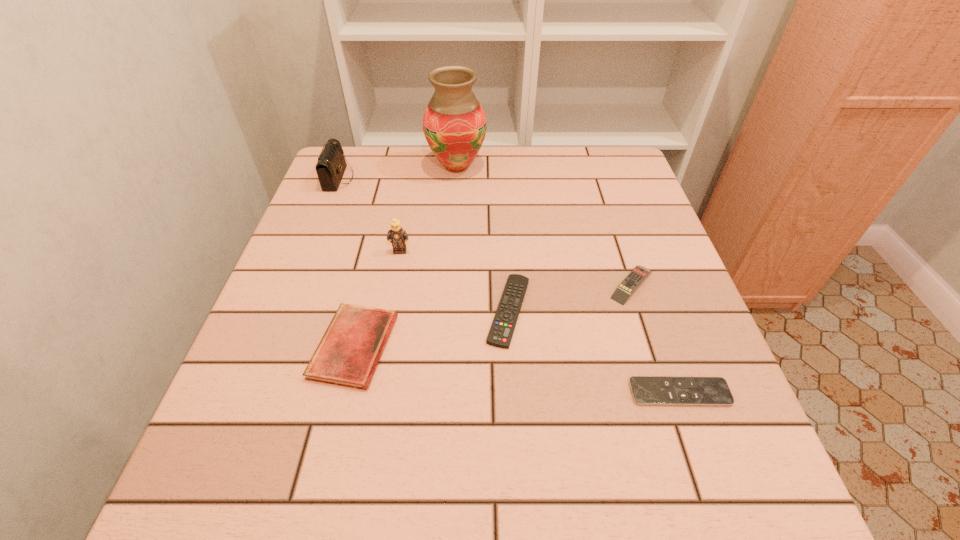
Locate an element on the screen. vase is located at coordinates (454, 124).

The image size is (960, 540). I want to click on the fifth nearest object, so click(x=397, y=235).

Find the location of a particular element. the leftmost object is located at coordinates (331, 165).

Locate an element on the screen. Image resolution: width=960 pixels, height=540 pixels. the tallest remote control is located at coordinates (626, 288).

Where is `diary`? This screenshot has width=960, height=540. diary is located at coordinates (348, 354).

At what (x,y) coordinates should I click in order to perform the action: click on the second shortest remote control. Please return your answer as a coordinate pair (x, y). The image size is (960, 540). Looking at the image, I should click on (500, 335).

Image resolution: width=960 pixels, height=540 pixels. I want to click on the sixth tallest object, so click(x=500, y=335).

Where is `the shortest remote control`? This screenshot has width=960, height=540. the shortest remote control is located at coordinates (646, 390).

You are a GUI agent. You are given a task and a screenshot of the screen. Output one action in this format:
    pyautogui.click(x=<x>, y=<y>)
    Task: Click on the shortest object
    
    Given the screenshot: What is the action you would take?
    pyautogui.click(x=646, y=390)

Where is `free point located on the front of the vase`? The width and height of the screenshot is (960, 540). free point located on the front of the vase is located at coordinates (448, 286).